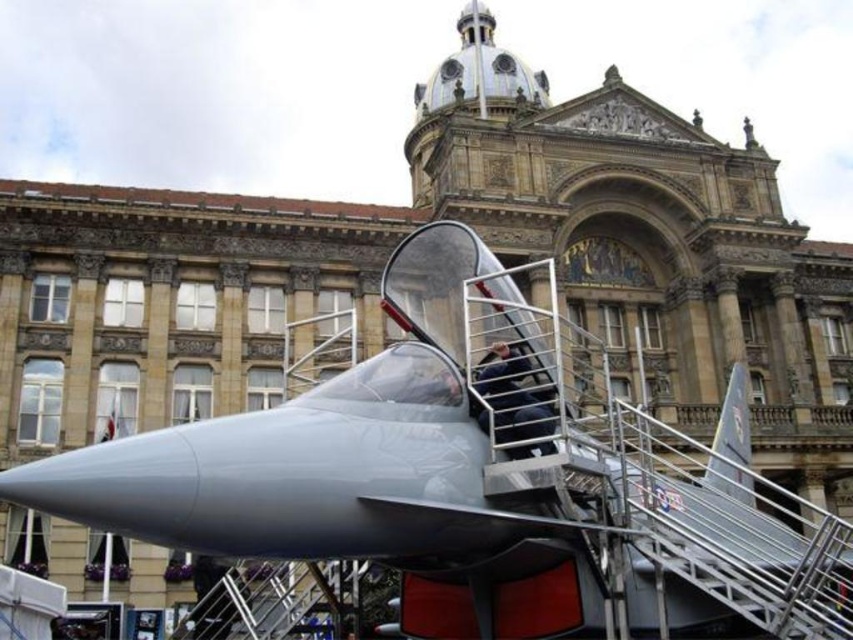
You are a visitor standing at the entrance of the historic building and want to take a photo of the metallic gray jet at center and the stainless steel staircase at center. If you want to include both objects in your photo, which one should you focus on first to ensure both are in frame?

You should focus on the metallic gray jet at center first because it is located above the stainless steel staircase at center, so adjusting the camera angle to capture the higher object first will help include both in the frame.

You are a tour guide leading a group to the cockpit of the metallic gray jet at center. The group includes a person in a wheelchair. Is the stainless steel staircase at center accessible to them?

The metallic gray jet at center is 12.88 meters away from the stainless steel staircase at center. However, the question of accessibility depends on whether the staircase has ramps or handrails. Since the scene description mentions the staircase is metallic and leads to the cockpit but does not specify accessibility features, it is unclear if the stainless steel staircase at center is wheelchair accessible.

You are planning to take a photo of the metallic gray jet at center and the stainless steel staircase at center from a distance. Which object will appear bigger in the photo?

The metallic gray jet at center will appear bigger in the photo because it is larger in size than the stainless steel staircase at center.